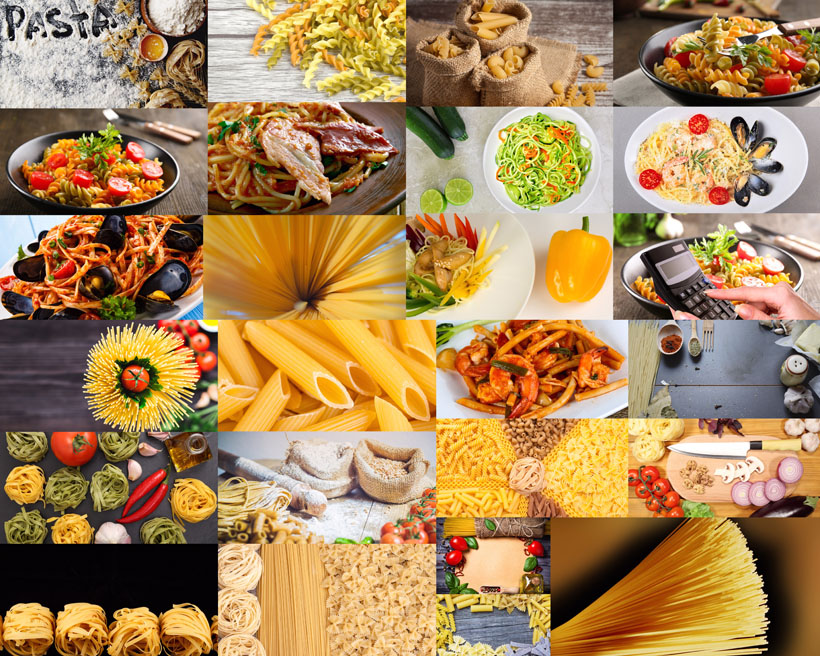
Where is `images with prepared/cooked pasta`? This screenshot has height=656, width=820. images with prepared/cooked pasta is located at coordinates (129, 255), (114, 174), (280, 161), (531, 371), (474, 277), (753, 260), (707, 165), (547, 159), (740, 63).